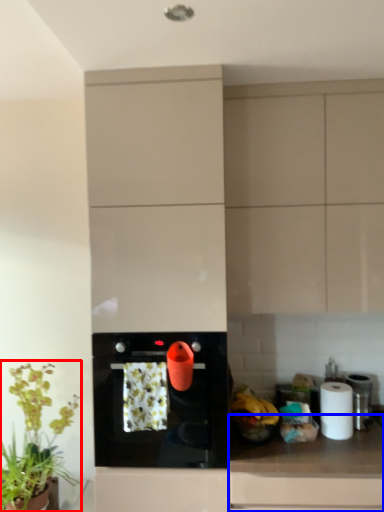
Question: Which object is further to the camera taking this photo, houseplant (highlighted by a red box) or countertop (highlighted by a blue box)?

Choices:
 (A) houseplant
 (B) countertop

Answer: (A)